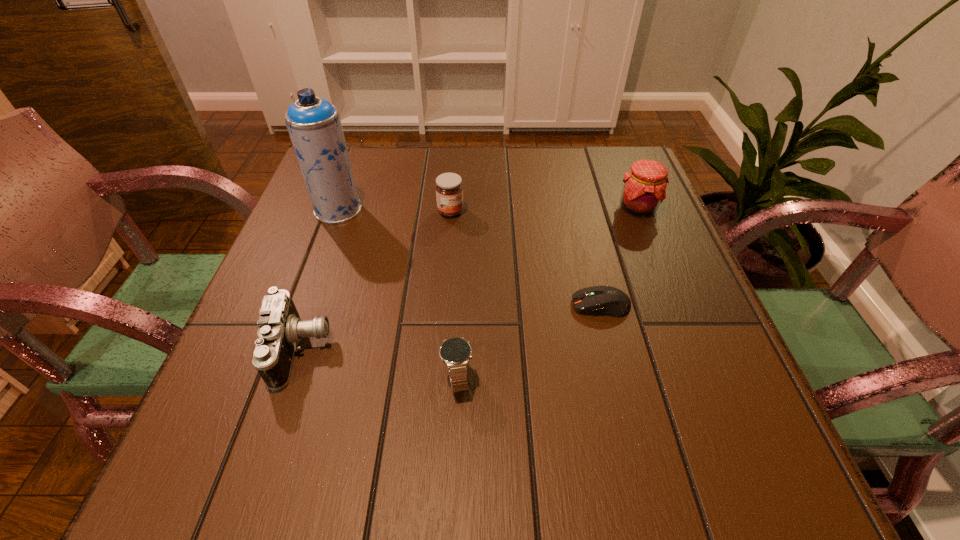
Locate an element on the screen. empty space that is in between the watch and the camera is located at coordinates (379, 364).

You are a GUI agent. You are given a task and a screenshot of the screen. Output one action in this format:
    pyautogui.click(x=<x>, y=<y>)
    Task: Click on the unoccupied area between the camera and the aerosol can
    The width and height of the screenshot is (960, 540).
    Given the screenshot: What is the action you would take?
    pyautogui.click(x=319, y=280)

You are a GUI agent. You are given a task and a screenshot of the screen. Output one action in this format:
    pyautogui.click(x=<x>, y=<y>)
    Task: Click on the vacant region between the second object from right to left and the watch
    
    Given the screenshot: What is the action you would take?
    (x=529, y=341)

The image size is (960, 540). Identify the location of free point between the aerosol can and the watch. (397, 294).

Identify the location of unoccupied area between the watch and the aerosol can. (397, 294).

The width and height of the screenshot is (960, 540). Identify the location of vacant point located between the tallest object and the computer equipment. (469, 257).

The width and height of the screenshot is (960, 540). Find the location of `empty space between the camera and the tallest object`. empty space between the camera and the tallest object is located at coordinates (319, 280).

You are a GUI agent. You are given a task and a screenshot of the screen. Output one action in this format:
    pyautogui.click(x=<x>, y=<y>)
    Task: Click on the free area in between the left jam and the tallest object
    This screenshot has width=960, height=540.
    Given the screenshot: What is the action you would take?
    pyautogui.click(x=395, y=211)

In order to click on unoccupied area between the watch and the shortest object in this screenshot , I will do point(529,341).

Select which object appears as the closest to the fifth object from left to right. Please provide its 2D coordinates. Your answer should be formatted as a tuple, i.e. [(x, y)], where the tuple contains the x and y coordinates of a point satisfying the conditions above.

[(455, 352)]